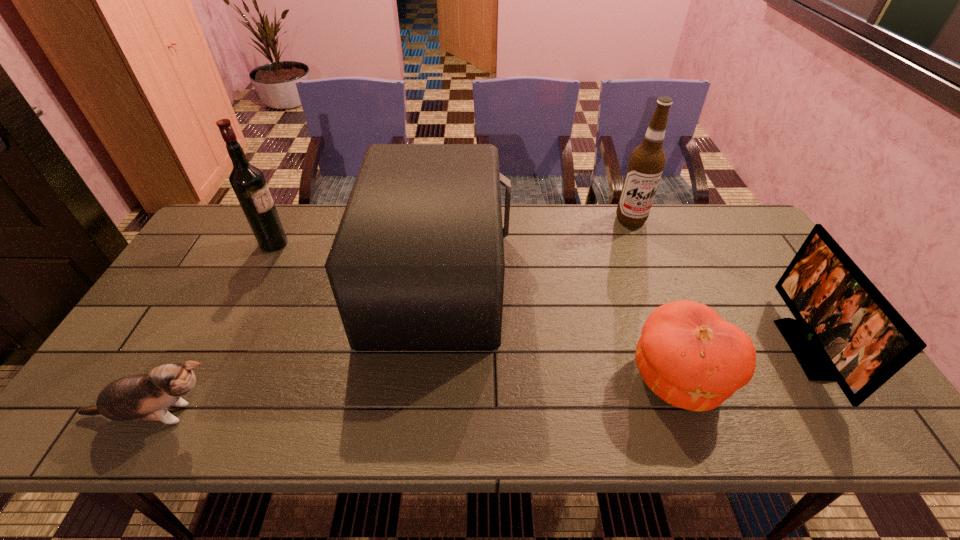
Where is `free location that satisfies the following two spatial constraints: 1. on the label of the alcohol; 2. on the front and back of the wine bottle`? free location that satisfies the following two spatial constraints: 1. on the label of the alcohol; 2. on the front and back of the wine bottle is located at coordinates (640, 244).

Identify the location of free space that satisfies the following two spatial constraints: 1. on the label of the alcohol; 2. at the face of the cat. (708, 415).

Identify the location of blank space that satisfies the following two spatial constraints: 1. on the front and back of the wine bottle; 2. on the back side of the pumpkin. (205, 379).